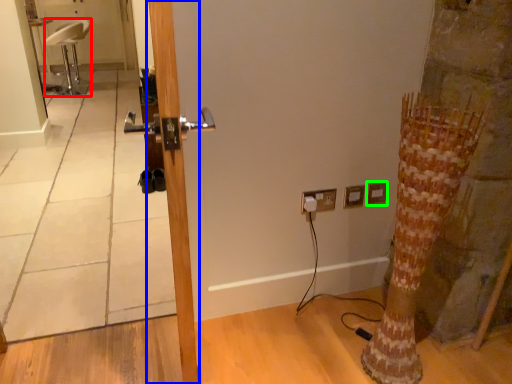
Question: Considering the real-world distances, which object is farthest from chair (highlighted by a red box)? door (highlighted by a blue box) or electric outlet (highlighted by a green box)?

Choices:
 (A) door
 (B) electric outlet

Answer: (A)